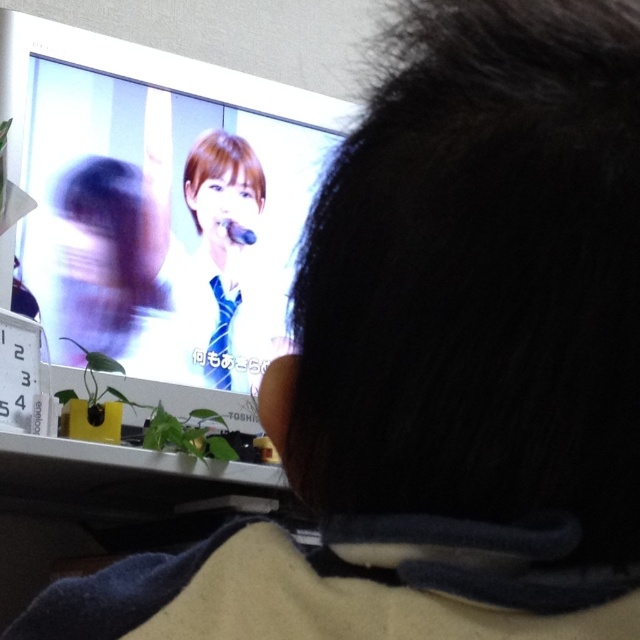
You are in a room and want to place a new plant on the desk where the TV is located. The desk has limited space. The white glossy monitor at upper center is represented by point (157, 204). Where should you place the new plant to avoid blocking the monitor?

Place the new plant away from the point (157, 204) to avoid blocking the white glossy monitor at upper center.

You are a delivery robot with a width of 6 inches. You need to move from the entrance to the desk where the white glossy monitor at upper center and blue silk tie at center are located. Can you pass between these two objects without touching them?

The white glossy monitor at upper center and blue silk tie at center are 7.03 inches apart from each other, so yes, the robot can pass between them as the distance is greater than its 6 inches width.

You are a delivery robot with a height of 1.5 meters. You are in the room and need to deliver a package to the white glossy monitor at upper center. The path to the monitor is clear except for a low table that is 0.5 meters tall. Can you reach the monitor without bending down?

The white glossy monitor at upper center is 1.04 meters away from the viewer. Since the delivery robot is 1.5 meters tall and the table is only 0.5 meters tall, the robot can easily reach the monitor without bending down as the table is not an obstacle in height.